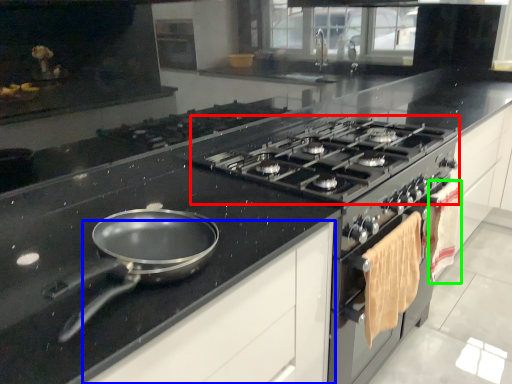
Question: Which object is the closest to the gas stove (highlighted by a red box)? Choose among these: cabinetry (highlighted by a blue box) or material (highlighted by a green box).

Choices:
 (A) cabinetry
 (B) material

Answer: (B)